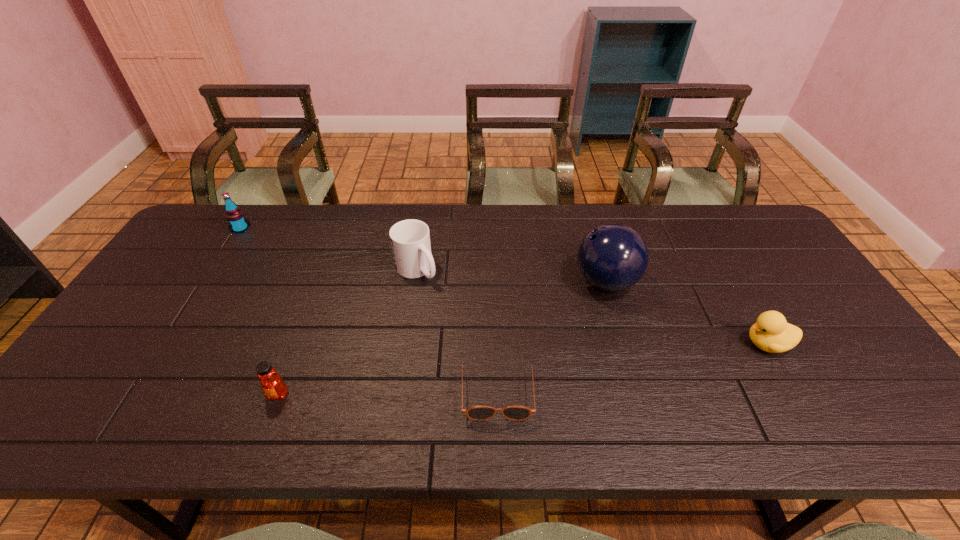
In order to click on the fifth object from left to right in this screenshot , I will do `click(612, 257)`.

You are a GUI agent. You are given a task and a screenshot of the screen. Output one action in this format:
    pyautogui.click(x=<x>, y=<y>)
    Task: Click on the bowling ball
    The width and height of the screenshot is (960, 540).
    Given the screenshot: What is the action you would take?
    pyautogui.click(x=612, y=257)

Find the location of a particular element. The width and height of the screenshot is (960, 540). soda is located at coordinates click(235, 217).

You are a GUI agent. You are given a task and a screenshot of the screen. Output one action in this format:
    pyautogui.click(x=<x>, y=<y>)
    Task: Click on the farthest object
    
    Given the screenshot: What is the action you would take?
    pyautogui.click(x=235, y=217)

The width and height of the screenshot is (960, 540). I want to click on mug, so click(410, 239).

Identify the location of duck. The image size is (960, 540). (x=771, y=333).

Locate an element on the screen. The image size is (960, 540). the second object from left to right is located at coordinates (273, 386).

You are a GUI agent. You are given a task and a screenshot of the screen. Output one action in this format:
    pyautogui.click(x=<x>, y=<y>)
    Task: Click on the sunglasses
    The image size is (960, 540).
    Given the screenshot: What is the action you would take?
    click(477, 413)

This screenshot has height=540, width=960. In order to click on the third object from right to left in this screenshot , I will do `click(477, 413)`.

This screenshot has height=540, width=960. Find the location of `free space located on the surface of the bowling ball near the finger holes`. free space located on the surface of the bowling ball near the finger holes is located at coordinates (549, 282).